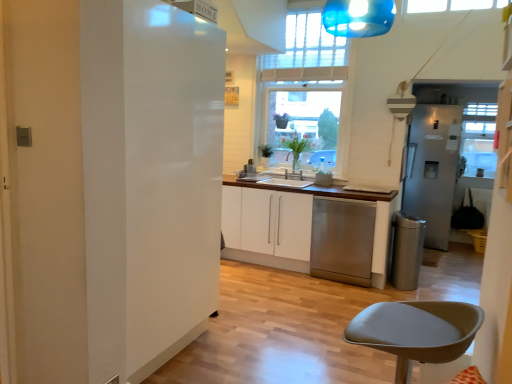
Question: Is matte gray stool at lower right smaller than stainless steel dishwasher at center?

Choices:
 (A) yes
 (B) no

Answer: (A)

Question: Is matte gray stool at lower right taller than stainless steel dishwasher at center?

Choices:
 (A) no
 (B) yes

Answer: (A)

Question: From a real-world perspective, does matte gray stool at lower right stand above stainless steel dishwasher at center?

Choices:
 (A) yes
 (B) no

Answer: (A)

Question: Is matte gray stool at lower right to the right of stainless steel dishwasher at center from the viewer's perspective?

Choices:
 (A) no
 (B) yes

Answer: (A)

Question: From a real-world perspective, is matte gray stool at lower right positioned under stainless steel dishwasher at center based on gravity?

Choices:
 (A) yes
 (B) no

Answer: (B)

Question: Is matte gray stool at lower right completely or partially outside of stainless steel dishwasher at center?

Choices:
 (A) yes
 (B) no

Answer: (A)

Question: Is satin silver refrigerator at right, which appears as the 1th fridge when viewed from the back, directly adjacent to stainless steel trash can at lower right?

Choices:
 (A) no
 (B) yes

Answer: (A)

Question: Is stainless steel trash can at lower right completely or partially inside satin silver refrigerator at right, the 2th fridge in the front-to-back sequence?

Choices:
 (A) no
 (B) yes

Answer: (A)

Question: Is satin silver refrigerator at right, the first fridge from the right, looking in the opposite direction of stainless steel trash can at lower right?

Choices:
 (A) yes
 (B) no

Answer: (B)

Question: From a real-world perspective, is satin silver refrigerator at right, the 2th fridge in the front-to-back sequence, on stainless steel trash can at lower right?

Choices:
 (A) yes
 (B) no

Answer: (A)

Question: Is there a large distance between satin silver refrigerator at right, which appears as the 1th fridge when viewed from the back, and stainless steel trash can at lower right?

Choices:
 (A) yes
 (B) no

Answer: (A)

Question: Considering the relative sizes of satin silver refrigerator at right, arranged as the second fridge when viewed from the left, and stainless steel trash can at lower right in the image provided, is satin silver refrigerator at right, arranged as the second fridge when viewed from the left, wider than stainless steel trash can at lower right?

Choices:
 (A) no
 (B) yes

Answer: (B)

Question: Can you confirm if stainless steel trash can at lower right is positioned to the right of stainless steel dishwasher at center?

Choices:
 (A) yes
 (B) no

Answer: (A)